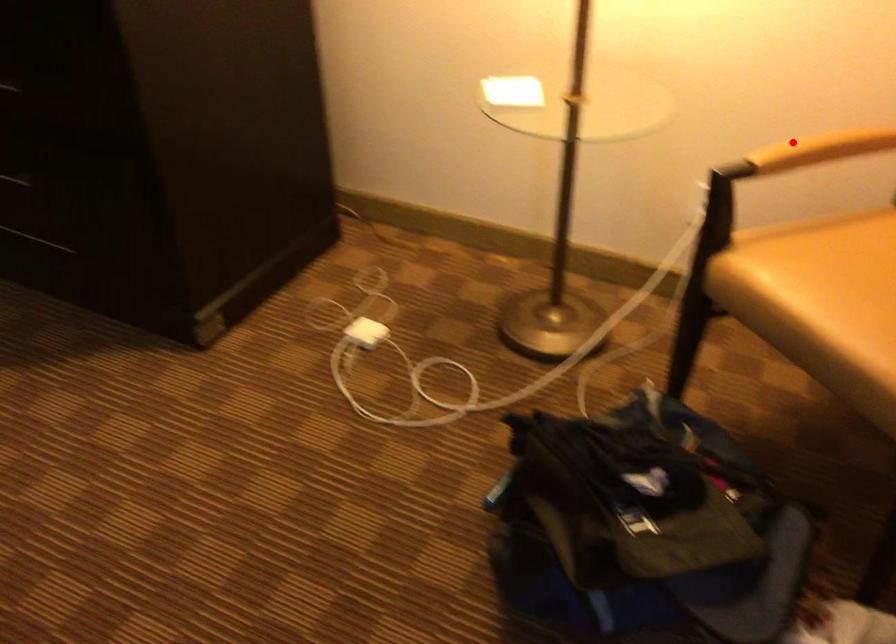
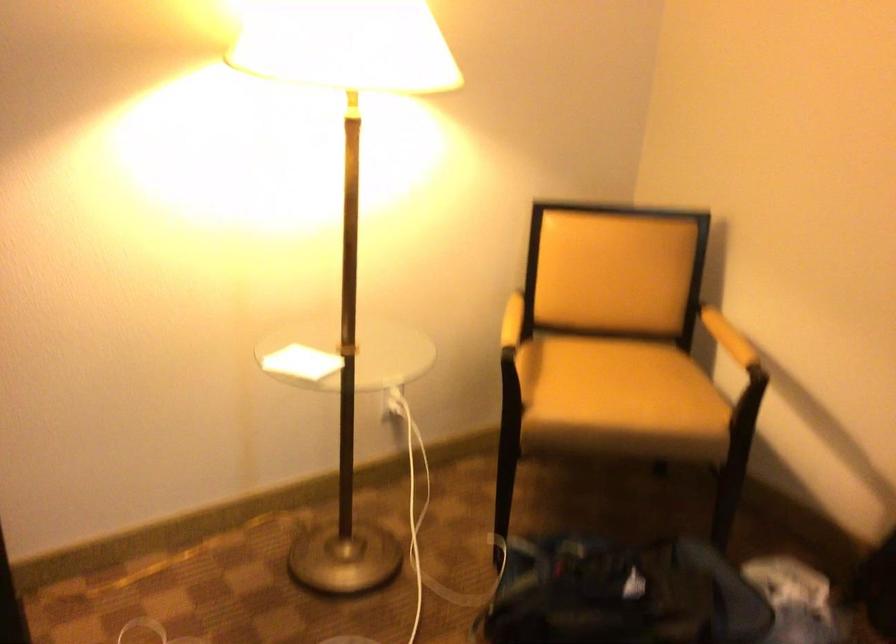
Question: I am providing you with two images of the same scene from different viewpoints. Image1 has a red point marked. In image2, the corresponding 3D location appears at what relative position? Reply with the corresponding letter.

Choices:
 (A) Closer
 (B) Farther

Answer: (B)